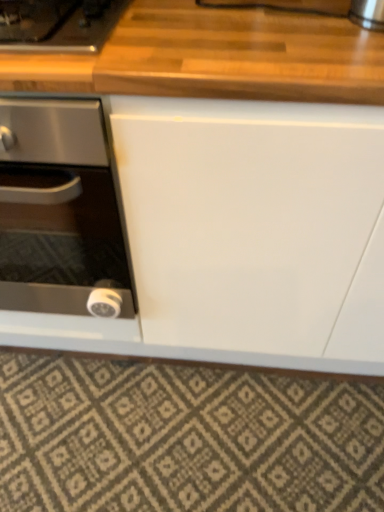
Question: Is the depth of textured beige rug at lower center less than that of wooden gas stove at upper left?

Choices:
 (A) yes
 (B) no

Answer: (B)

Question: From a real-world perspective, is textured beige rug at lower center beneath wooden gas stove at upper left?

Choices:
 (A) no
 (B) yes

Answer: (B)

Question: Is textured beige rug at lower center positioned far away from wooden gas stove at upper left?

Choices:
 (A) yes
 (B) no

Answer: (B)

Question: Can you confirm if textured beige rug at lower center is wider than wooden gas stove at upper left?

Choices:
 (A) yes
 (B) no

Answer: (B)

Question: Is textured beige rug at lower center taller than wooden gas stove at upper left?

Choices:
 (A) yes
 (B) no

Answer: (B)

Question: Can you confirm if textured beige rug at lower center is positioned to the right of wooden gas stove at upper left?

Choices:
 (A) no
 (B) yes

Answer: (B)

Question: Is wooden gas stove at upper left completely or partially outside of black glass stove at left?

Choices:
 (A) no
 (B) yes

Answer: (B)

Question: From the image's perspective, is wooden gas stove at upper left under black glass stove at left?

Choices:
 (A) yes
 (B) no

Answer: (B)

Question: Is wooden gas stove at upper left wider than black glass stove at left?

Choices:
 (A) yes
 (B) no

Answer: (B)

Question: Can you confirm if wooden gas stove at upper left is smaller than black glass stove at left?

Choices:
 (A) yes
 (B) no

Answer: (A)

Question: Is wooden gas stove at upper left surrounding black glass stove at left?

Choices:
 (A) no
 (B) yes

Answer: (A)

Question: Considering the relative positions of wooden gas stove at upper left and black glass stove at left in the image provided, is wooden gas stove at upper left behind black glass stove at left?

Choices:
 (A) no
 (B) yes

Answer: (B)

Question: From the image's perspective, is black glass stove at left beneath wooden gas stove at upper left?

Choices:
 (A) yes
 (B) no

Answer: (A)